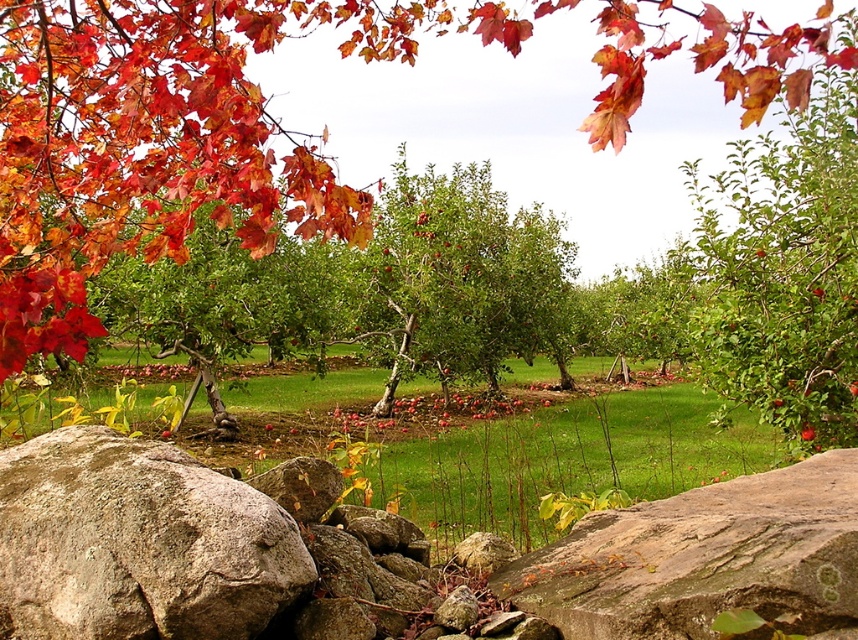
Between gray rough boulder at lower left and brown rough rock at lower center, which one appears on the left side from the viewer's perspective?

From the viewer's perspective, gray rough boulder at lower left appears more on the left side.

Does point (219, 605) lie in front of point (826, 582)?

No.

Does point (125, 448) come farther from viewer compared to point (820, 586)?

Yes, point (125, 448) is farther from viewer.

Locate an element on the screen. The image size is (858, 640). gray rough boulder at lower left is located at coordinates (137, 541).